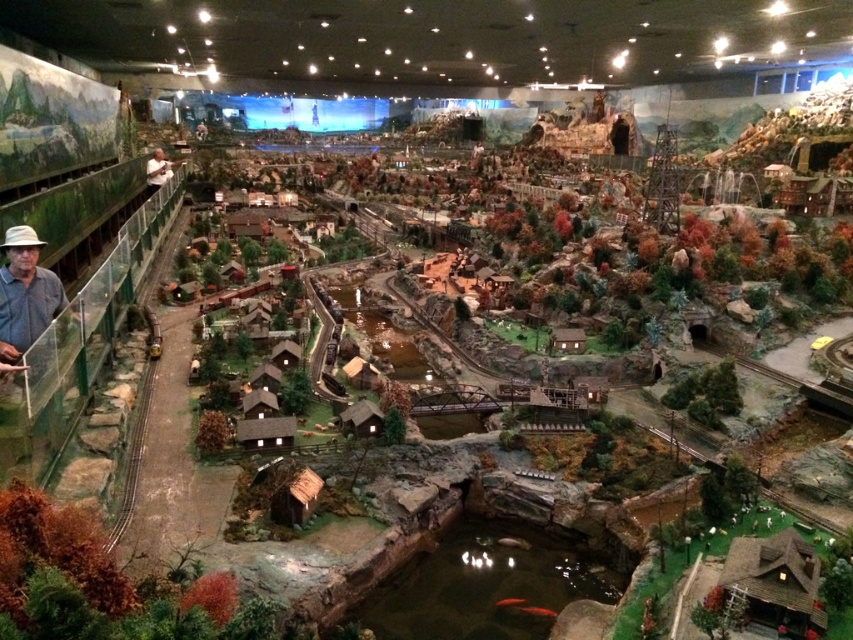
You are a visitor at the model railway exhibit and see two shirts displayed in the miniature diorama. The shirts are labeled as denim shirt at left and smooth tan shirt at left. Which shirt is positioned more to the right side?

The denim shirt at left is positioned more to the right side than the smooth tan shirt at left.